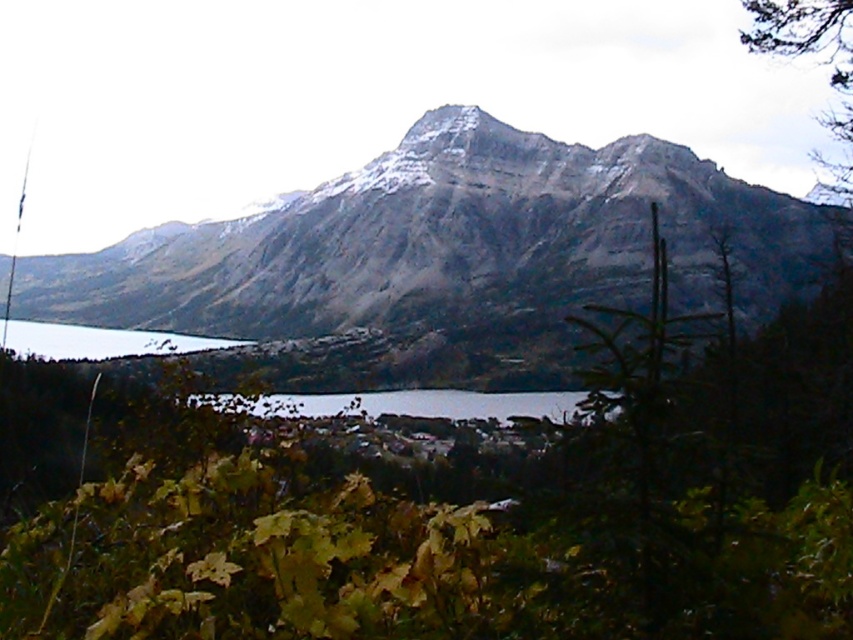
Is point (165, 248) more distant than point (775, 26)?

Yes, it is.

Can you confirm if snowy rock mountain at center is positioned below brown textured tree at upper right?

Yes, snowy rock mountain at center is below brown textured tree at upper right.

The image size is (853, 640). Find the location of `snowy rock mountain at center`. snowy rock mountain at center is located at coordinates (447, 257).

Find the location of `snowy rock mountain at center`. snowy rock mountain at center is located at coordinates (447, 257).

In the scene shown: Can you confirm if snowy rock mountain at center is thinner than clear water at center?

No, snowy rock mountain at center is not thinner than clear water at center.

Who is lower down, snowy rock mountain at center or clear water at center?

clear water at center is lower down.

Does point (583, 234) come in front of point (416, 392)?

No.

The image size is (853, 640). In order to click on snowy rock mountain at center in this screenshot , I will do `click(447, 257)`.

Is point (485, 410) more distant than point (47, 342)?

That is False.

Between point (431, 396) and point (90, 353), which one is positioned in front?

Point (431, 396) is more forward.

The width and height of the screenshot is (853, 640). Describe the element at coordinates (410, 403) in the screenshot. I see `clear water at center` at that location.

Where is `clear water at center`? This screenshot has height=640, width=853. clear water at center is located at coordinates coord(410,403).